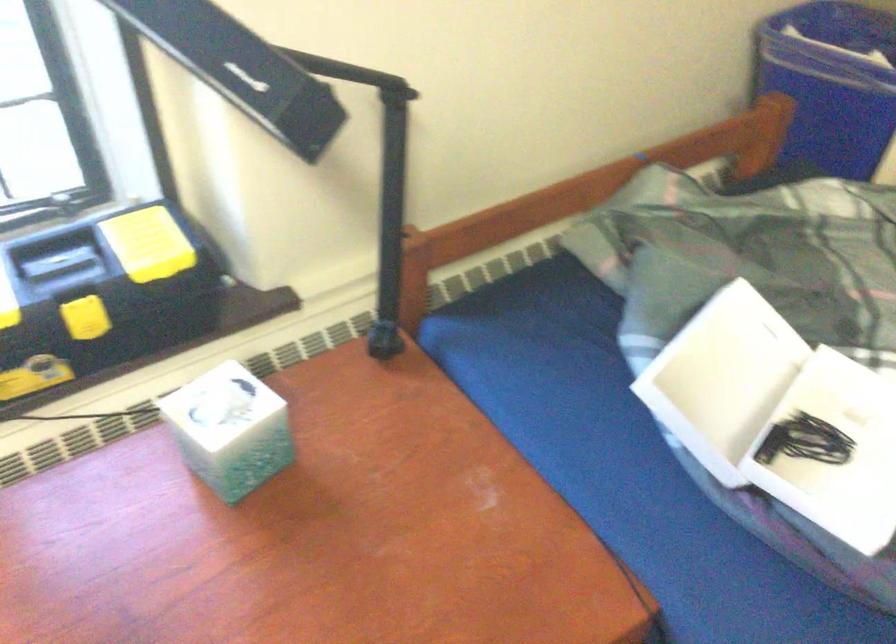
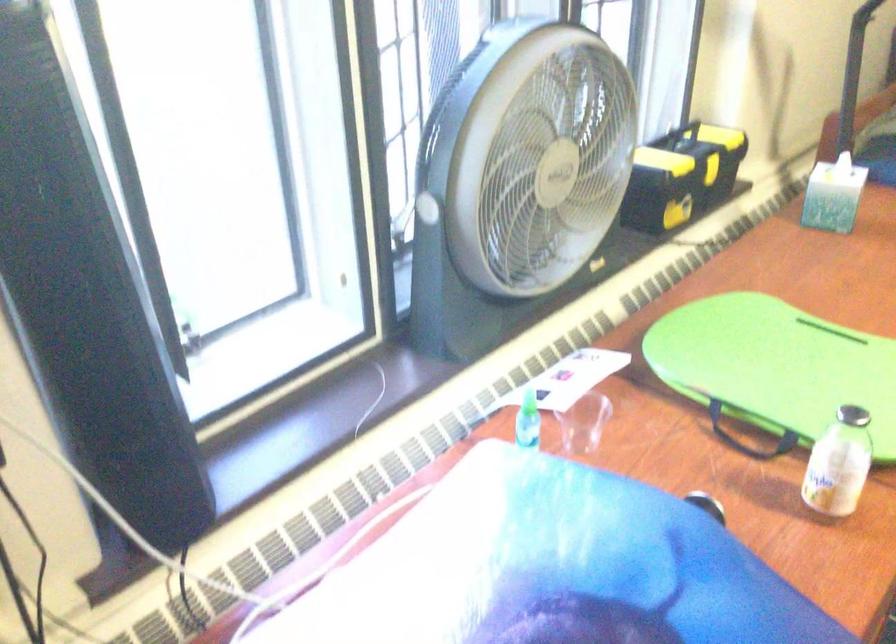
What movement of the cameraman would produce the second image?

The cameraman walked toward left, backward.